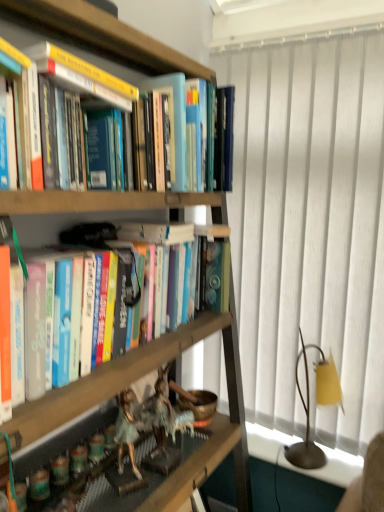
Question: Can you confirm if hardcover books at center is bigger than metallic figurines at lower left?

Choices:
 (A) yes
 (B) no

Answer: (A)

Question: Is hardcover books at center oriented towards metallic figurines at lower left?

Choices:
 (A) no
 (B) yes

Answer: (A)

Question: From a real-world perspective, is hardcover books at center below metallic figurines at lower left?

Choices:
 (A) no
 (B) yes

Answer: (A)

Question: Is hardcover books at center turned away from metallic figurines at lower left?

Choices:
 (A) yes
 (B) no

Answer: (B)

Question: From a real-world perspective, is hardcover books at center on top of metallic figurines at lower left?

Choices:
 (A) yes
 (B) no

Answer: (A)

Question: Is hardcover books at center not close to metallic figurines at lower left?

Choices:
 (A) yes
 (B) no

Answer: (B)

Question: From the image's perspective, would you say white textured curtain at right is positioned over hardcover book at upper left, marked as the 1th paperback book in a front-to-back arrangement?

Choices:
 (A) no
 (B) yes

Answer: (A)

Question: Is white textured curtain at right positioned before hardcover book at upper left, which is the 2th paperback book from back to front?

Choices:
 (A) yes
 (B) no

Answer: (B)

Question: Does white textured curtain at right have a greater width compared to hardcover book at upper left, which is the 2th paperback book from back to front?

Choices:
 (A) no
 (B) yes

Answer: (A)

Question: Is white textured curtain at right not inside hardcover book at upper left, which is the 2th paperback book from back to front?

Choices:
 (A) no
 (B) yes

Answer: (B)

Question: Considering the relative positions of white textured curtain at right and hardcover book at upper left, which is the 2th paperback book from back to front, in the image provided, is white textured curtain at right to the left of hardcover book at upper left, which is the 2th paperback book from back to front, from the viewer's perspective?

Choices:
 (A) no
 (B) yes

Answer: (A)

Question: Would you say white textured curtain at right is a long distance from hardcover book at upper left, which is the 2th paperback book from back to front?

Choices:
 (A) no
 (B) yes

Answer: (A)

Question: Is white textured curtain at right positioned far away from yellow fabric lampshade at right?

Choices:
 (A) yes
 (B) no

Answer: (B)